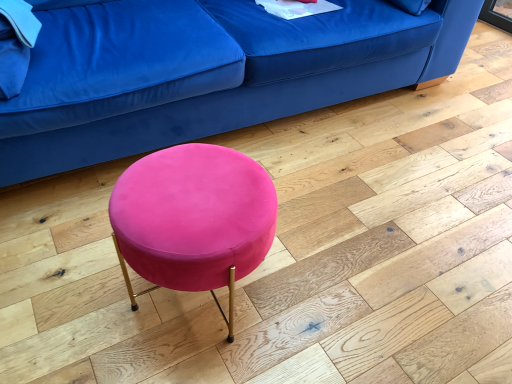
At what (x,y) coordinates should I click in order to perform the action: click on free space above velvet pink stool at center (from a real-world perspective). Please return your answer as a coordinate pair (x, y). Looking at the image, I should click on (195, 191).